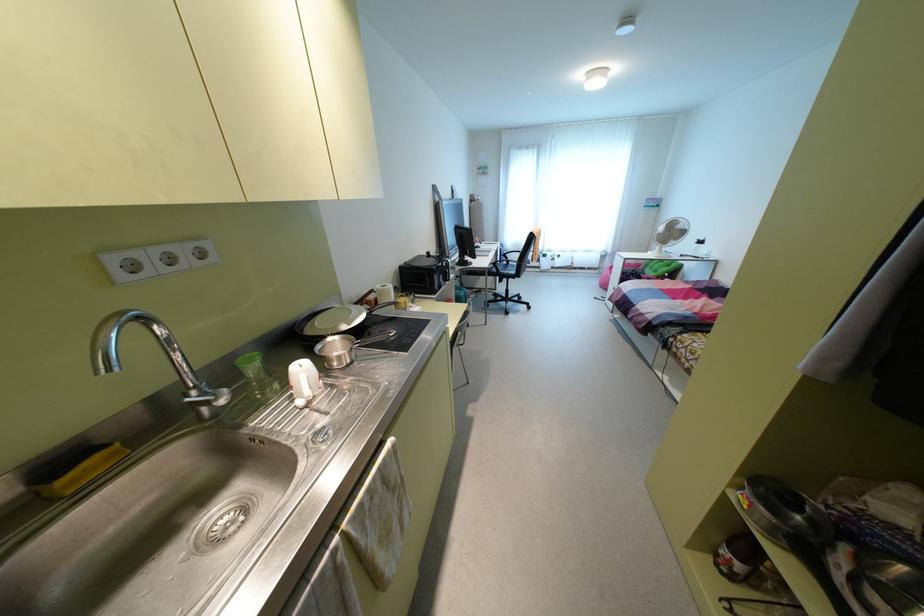
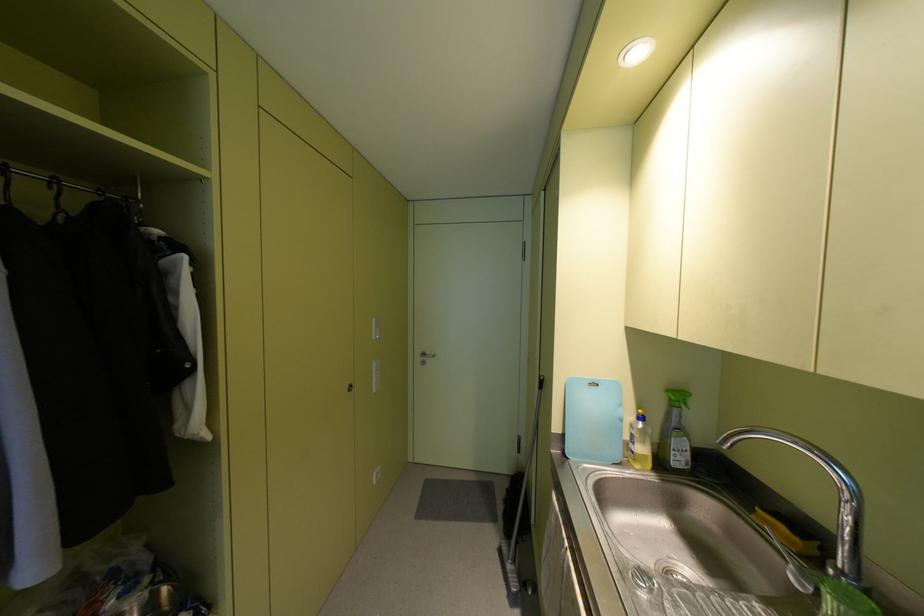
The point at [59,482] is marked in the first image. Where is the corresponding point in the second image?

(759, 511)